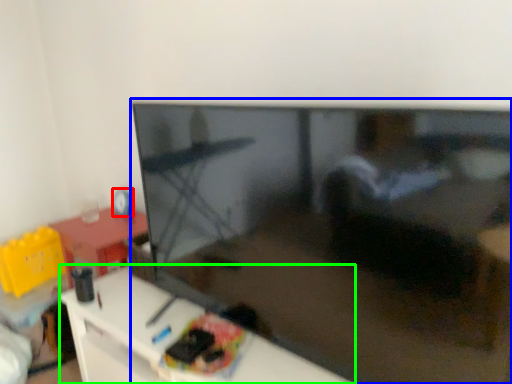
Question: Estimate the real-world distances between objects in this image. Which object is closer to toy (highlighted by a red box), television (highlighted by a blue box) or furniture (highlighted by a green box)?

Choices:
 (A) television
 (B) furniture

Answer: (B)